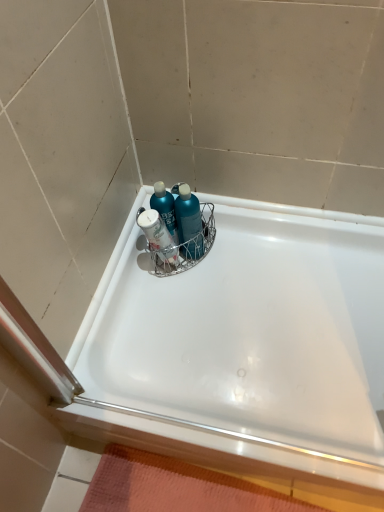
This screenshot has width=384, height=512. In order to click on vacant space to the right of teal glossy bottle at center in this screenshot , I will do `click(228, 264)`.